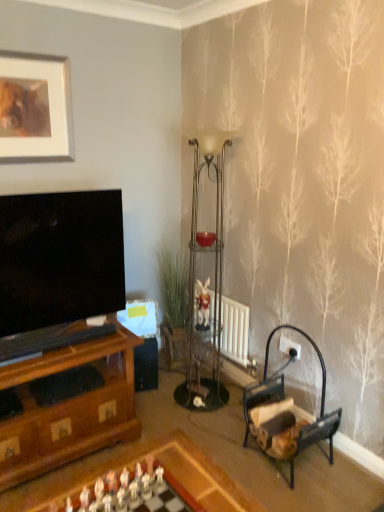
Question: Considering the relative sizes of wooden chessboard at lower center and wooden armchair at lower right in the image provided, is wooden chessboard at lower center shorter than wooden armchair at lower right?

Choices:
 (A) yes
 (B) no

Answer: (A)

Question: Can you confirm if wooden chessboard at lower center is thinner than wooden armchair at lower right?

Choices:
 (A) no
 (B) yes

Answer: (A)

Question: Considering the relative sizes of wooden chessboard at lower center and wooden armchair at lower right in the image provided, is wooden chessboard at lower center wider than wooden armchair at lower right?

Choices:
 (A) no
 (B) yes

Answer: (B)

Question: Considering the relative sizes of wooden chessboard at lower center and wooden armchair at lower right in the image provided, is wooden chessboard at lower center bigger than wooden armchair at lower right?

Choices:
 (A) no
 (B) yes

Answer: (B)

Question: From a real-world perspective, is wooden chessboard at lower center physically below wooden armchair at lower right?

Choices:
 (A) yes
 (B) no

Answer: (A)

Question: In the image, is wooden armchair at lower right on the left side or the right side of metallic glass side table at center?

Choices:
 (A) right
 (B) left

Answer: (A)

Question: Considering the positions of wooden armchair at lower right and metallic glass side table at center in the image, is wooden armchair at lower right taller or shorter than metallic glass side table at center?

Choices:
 (A) tall
 (B) short

Answer: (A)

Question: In terms of width, does wooden armchair at lower right look wider or thinner when compared to metallic glass side table at center?

Choices:
 (A) wide
 (B) thin

Answer: (A)

Question: Is wooden armchair at lower right in front of or behind metallic glass side table at center in the image?

Choices:
 (A) behind
 (B) front

Answer: (B)

Question: Is metallic glass side table at center inside or outside of metallic glass shelf at center?

Choices:
 (A) inside
 (B) outside

Answer: (A)

Question: Looking at their shapes, would you say metallic glass side table at center is wider or thinner than metallic glass shelf at center?

Choices:
 (A) thin
 (B) wide

Answer: (A)

Question: From a real-world perspective, relative to metallic glass shelf at center, is metallic glass side table at center vertically above or below?

Choices:
 (A) below
 (B) above

Answer: (A)

Question: Is metallic glass side table at center bigger or smaller than metallic glass shelf at center?

Choices:
 (A) big
 (B) small

Answer: (B)

Question: Is matte silver picture frame at upper left in front of or behind matte glass candle holder at center in the image?

Choices:
 (A) front
 (B) behind

Answer: (A)

Question: Do you think matte silver picture frame at upper left is within matte glass candle holder at center, or outside of it?

Choices:
 (A) inside
 (B) outside

Answer: (B)